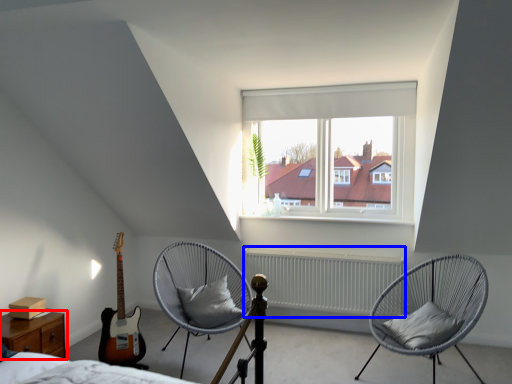
Question: Which object appears farthest to the camera in this image, nightstand (highlighted by a red box) or radiator (highlighted by a blue box)?

Choices:
 (A) nightstand
 (B) radiator

Answer: (B)